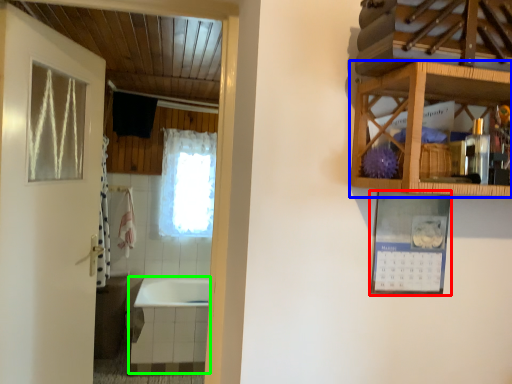
Question: Based on their relative distances, which object is nearer to picture frame (highlighted by a red box)? Choose from cabinetry (highlighted by a blue box) and bath (highlighted by a green box).

Choices:
 (A) cabinetry
 (B) bath

Answer: (A)